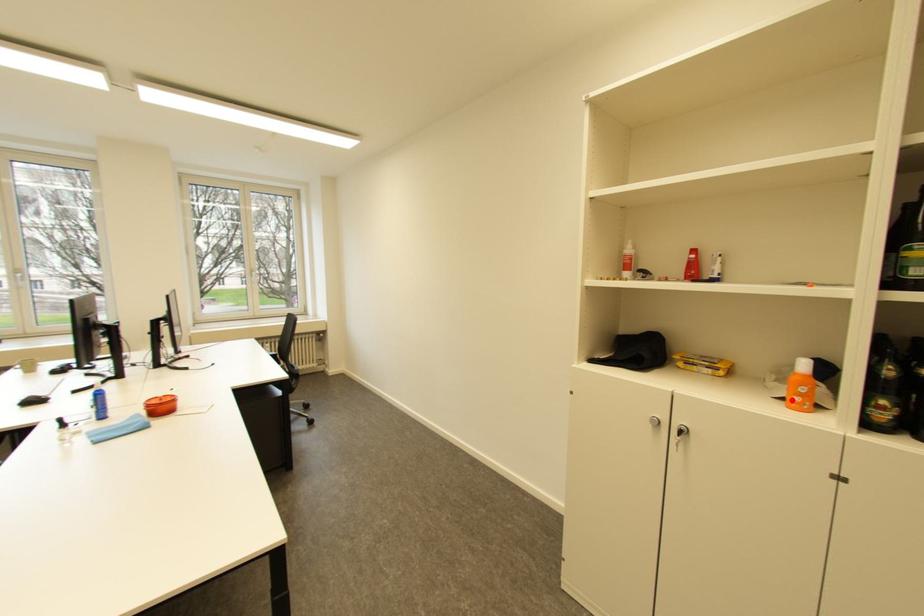
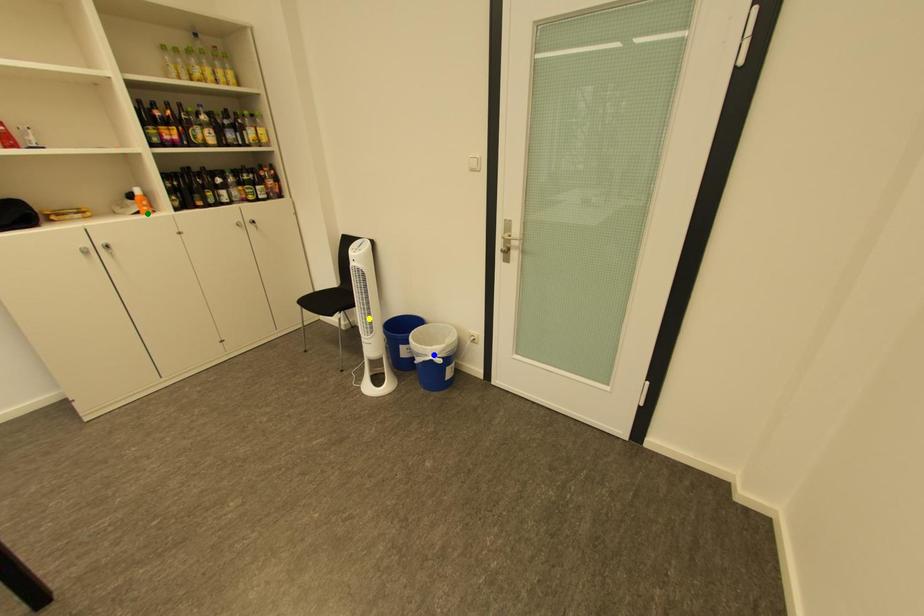
Question: I am providing you with two images of the same scene from different viewpoints. A red point is marked on the first image. You are given multiple points on the second image. Which point in image 2 is actually the same real-world point as the red point in image 1?

Choices:
 (A) blue point
 (B) yellow point
 (C) green point

Answer: (C)